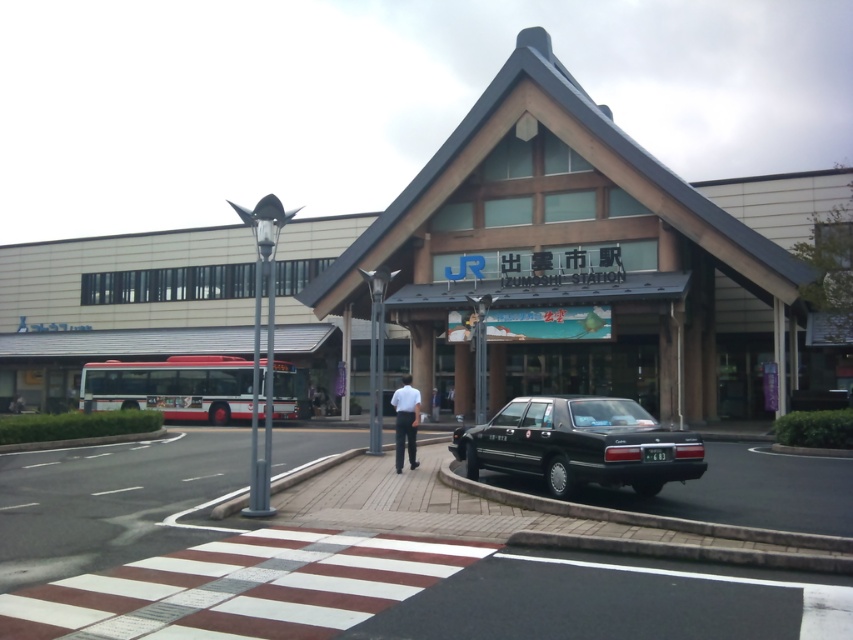
You are a pedestrian standing at the pedestrian crossing in front of Yunishi Station. You see a black glossy sedan at lower right and a white shirt at center. Which object is blocking your path?

The black glossy sedan at lower right is positioned over the white shirt at center, so the black glossy sedan at lower right is blocking your path.

You are a delivery person trying to load a tall package into your vehicle. You see the brown wooden mall at center and the black glossy sedan at lower right. Which vehicle can accommodate the tall package based on their heights?

The brown wooden mall at center has a greater height compared to the black glossy sedan at lower right, so the tall package can be accommodated in the brown wooden mall at center.

You are standing at the entrance of Yunishi Station and see a white shirt at center and a white fabric shirt at center. Which one is nearer to you?

The white shirt at center is closer to the viewer than the white fabric shirt at center.